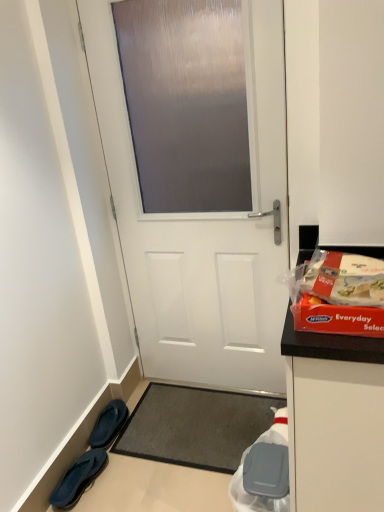
Question: From a real-world perspective, is white matte door at center on top of black fabric slippers at lower left, acting as the 1th footwear starting from the back?

Choices:
 (A) yes
 (B) no

Answer: (A)

Question: Is white matte door at center in contact with black fabric slippers at lower left, acting as the 1th footwear starting from the back?

Choices:
 (A) yes
 (B) no

Answer: (B)

Question: Considering the relative sizes of white matte door at center and black fabric slippers at lower left, acting as the 1th footwear starting from the back, in the image provided, is white matte door at center wider than black fabric slippers at lower left, acting as the 1th footwear starting from the back,?

Choices:
 (A) yes
 (B) no

Answer: (B)

Question: Is white matte door at center not near black fabric slippers at lower left, acting as the 1th footwear starting from the back?

Choices:
 (A) no
 (B) yes

Answer: (A)

Question: Considering the relative positions of white matte door at center and black fabric slippers at lower left, positioned as the second footwear in front-to-back order, in the image provided, is white matte door at center to the right of black fabric slippers at lower left, positioned as the second footwear in front-to-back order, from the viewer's perspective?

Choices:
 (A) no
 (B) yes

Answer: (B)

Question: Is black fabric slippers at lower left, acting as the 1th footwear starting from the back, in front of or behind dark gray textured mat at center in the image?

Choices:
 (A) behind
 (B) front

Answer: (A)

Question: Would you say black fabric slippers at lower left, positioned as the second footwear in front-to-back order, is inside or outside dark gray textured mat at center?

Choices:
 (A) outside
 (B) inside

Answer: (A)

Question: From a real-world perspective, is black fabric slippers at lower left, acting as the 1th footwear starting from the back, above or below dark gray textured mat at center?

Choices:
 (A) above
 (B) below

Answer: (A)

Question: Considering the positions of black fabric slippers at lower left, acting as the 1th footwear starting from the back, and dark gray textured mat at center in the image, is black fabric slippers at lower left, acting as the 1th footwear starting from the back, wider or thinner than dark gray textured mat at center?

Choices:
 (A) wide
 (B) thin

Answer: (B)

Question: From a real-world perspective, is black fabric slippers at lower left, acting as the 1th footwear starting from the back, physically located above or below white plastic bag at lower right, positioned as the 2th waste in top-to-bottom order?

Choices:
 (A) above
 (B) below

Answer: (B)

Question: Is black fabric slippers at lower left, acting as the 1th footwear starting from the back, in front of or behind white plastic bag at lower right, positioned as the 2th waste in top-to-bottom order, in the image?

Choices:
 (A) behind
 (B) front

Answer: (A)

Question: Considering the positions of point (119, 403) and point (264, 452), is point (119, 403) closer or farther from the camera than point (264, 452)?

Choices:
 (A) closer
 (B) farther

Answer: (B)

Question: Considering the positions of black fabric slippers at lower left, positioned as the second footwear in front-to-back order, and white plastic bag at lower right, arranged as the second waste when viewed from the front, in the image, is black fabric slippers at lower left, positioned as the second footwear in front-to-back order, taller or shorter than white plastic bag at lower right, arranged as the second waste when viewed from the front,?

Choices:
 (A) short
 (B) tall

Answer: (A)

Question: Is white plastic bag at lower right, positioned as the 2th waste in top-to-bottom order, spatially inside red plastic box at right, arranged as the second waste when viewed from the back, or outside of it?

Choices:
 (A) outside
 (B) inside

Answer: (A)

Question: Based on their sizes in the image, would you say white plastic bag at lower right, the 1th waste from the back, is bigger or smaller than red plastic box at right, arranged as the 1th waste when viewed from the top?

Choices:
 (A) small
 (B) big

Answer: (B)